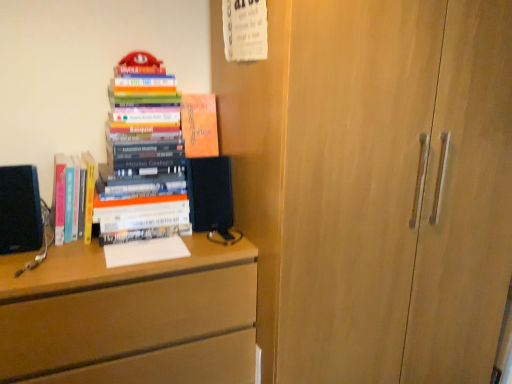
Question: From the image's perspective, is matte wood chest of drawers at left above hardcover books at left, the second book positioned from the left?

Choices:
 (A) yes
 (B) no

Answer: (B)

Question: Is the depth of matte wood chest of drawers at left greater than that of hardcover books at left, the second book positioned from the left?

Choices:
 (A) no
 (B) yes

Answer: (A)

Question: From a real-world perspective, does matte wood chest of drawers at left stand above hardcover books at left, the 2th book viewed from the right?

Choices:
 (A) yes
 (B) no

Answer: (B)

Question: Can you confirm if matte wood chest of drawers at left is taller than hardcover books at left, the 2th book viewed from the right?

Choices:
 (A) yes
 (B) no

Answer: (A)

Question: Is matte wood chest of drawers at left outside hardcover books at left, the second book positioned from the left?

Choices:
 (A) yes
 (B) no

Answer: (A)

Question: Is matte orange book at upper center, marked as the 3th book in a left-to-right arrangement, inside or outside of hardcover books at left, the third book from the right?

Choices:
 (A) inside
 (B) outside

Answer: (B)

Question: Is matte orange book at upper center, marked as the 3th book in a left-to-right arrangement, wider or thinner than hardcover books at left, placed as the 1th book when sorted from left to right?

Choices:
 (A) thin
 (B) wide

Answer: (A)

Question: Is matte orange book at upper center, the first book from the right, taller or shorter than hardcover books at left, placed as the 1th book when sorted from left to right?

Choices:
 (A) tall
 (B) short

Answer: (B)

Question: From a real-world perspective, is matte orange book at upper center, marked as the 3th book in a left-to-right arrangement, physically located above or below hardcover books at left, the third book from the right?

Choices:
 (A) below
 (B) above

Answer: (B)

Question: From a real-world perspective, is matte wood chest of drawers at left physically located above or below black matte speaker at center?

Choices:
 (A) below
 (B) above

Answer: (A)

Question: In terms of height, does matte wood chest of drawers at left look taller or shorter compared to black matte speaker at center?

Choices:
 (A) tall
 (B) short

Answer: (A)

Question: From the image's perspective, is matte wood chest of drawers at left located above or below black matte speaker at center?

Choices:
 (A) above
 (B) below

Answer: (B)

Question: Considering the positions of matte wood chest of drawers at left and black matte speaker at center in the image, is matte wood chest of drawers at left bigger or smaller than black matte speaker at center?

Choices:
 (A) small
 (B) big

Answer: (B)

Question: Visually, is matte orange book at upper center, marked as the 3th book in a left-to-right arrangement, positioned to the left or to the right of matte wood chest of drawers at left?

Choices:
 (A) left
 (B) right

Answer: (B)

Question: Is matte orange book at upper center, the first book from the right, in front of or behind matte wood chest of drawers at left in the image?

Choices:
 (A) behind
 (B) front

Answer: (A)